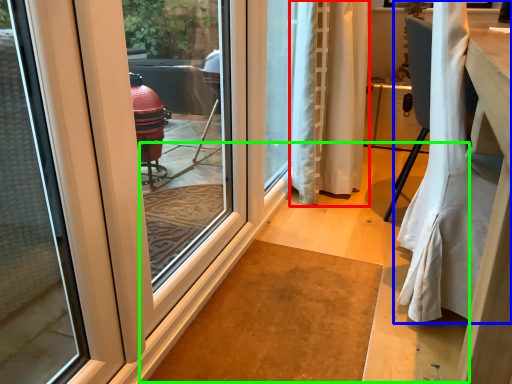
Question: Based on their relative distances, which object is nearer to curtain (highlighted by a red box)? Choose from curtain (highlighted by a blue box) and path (highlighted by a green box).

Choices:
 (A) curtain
 (B) path

Answer: (B)